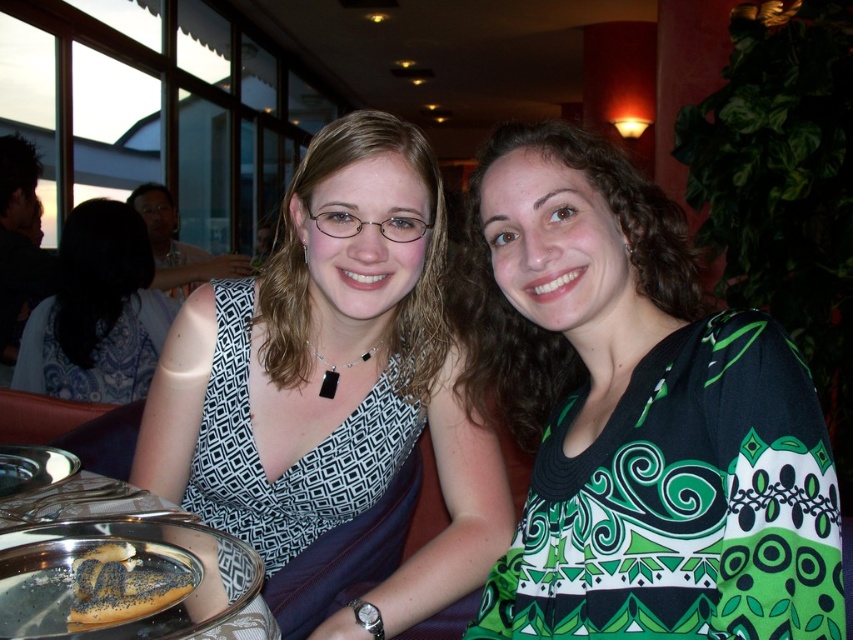
Is point (740, 420) positioned in front of point (120, 556)?

Yes, point (740, 420) is closer to viewer.

Can you confirm if green printed dress at center is shorter than brown poppy seed bagel at lower left?

In fact, green printed dress at center may be taller than brown poppy seed bagel at lower left.

The width and height of the screenshot is (853, 640). What do you see at coordinates (637, 416) in the screenshot?
I see `green printed dress at center` at bounding box center [637, 416].

The image size is (853, 640). I want to click on green printed dress at center, so click(637, 416).

Is matte black dress at center taller than black matte dress at center?

Yes.

The width and height of the screenshot is (853, 640). Find the location of `matte black dress at center`. matte black dress at center is located at coordinates (332, 380).

This screenshot has width=853, height=640. I want to click on green printed dress at center, so click(637, 416).

Does green printed dress at center appear on the right side of matte black dress at center?

Correct, you'll find green printed dress at center to the right of matte black dress at center.

Identify the location of green printed dress at center. The width and height of the screenshot is (853, 640). (637, 416).